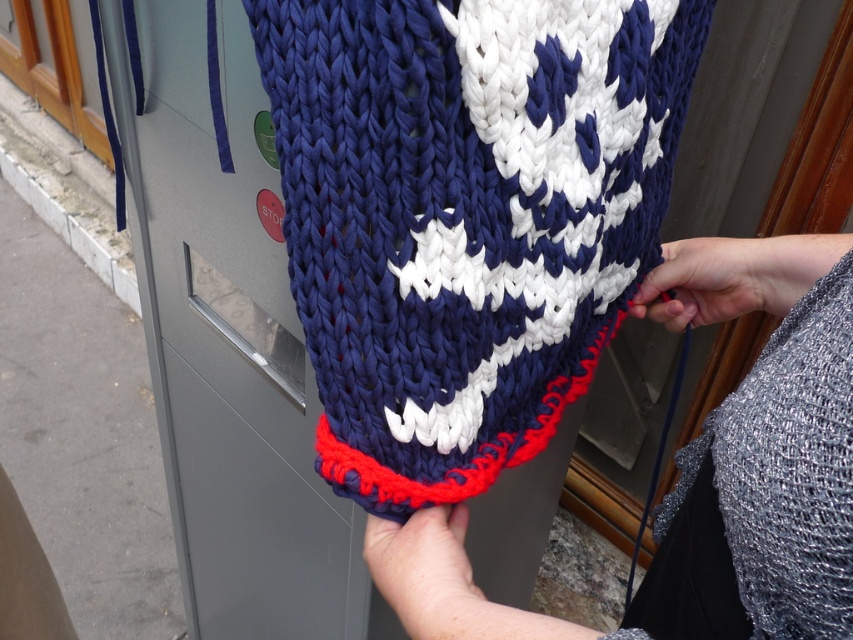
You are a photographer trying to capture a closeup of the white knitted scarf at center. The camera is currently positioned 27.33 inches away from the scarf. If you want to make the scarf appear larger in the photo, should you move the camera closer or farther away?

The white knitted scarf at center is 27.33 inches away from the camera. To make the scarf appear larger in the photo, you should move the camera closer to the scarf, decreasing the distance between the camera and the scarf.

You are a fashion designer examining a new scarf design. You notice the white knitted scarf at center and the smooth gray hand at center right in the image. Which object is positioned higher in the image?

The white knitted scarf at center is above the smooth gray hand at center right, so it is positioned higher in the image.

You are trying to determine if the white knitted scarf at center can be folded to fit into a small pouch that can only accommodate items narrower than the smooth skin hand at lower center. Based on the scene, is this possible?

The white knitted scarf at center is wider than the smooth skin hand at lower center. Since the scarf is already wider than the hand, it cannot be folded to fit into a pouch that requires items narrower than the hand.